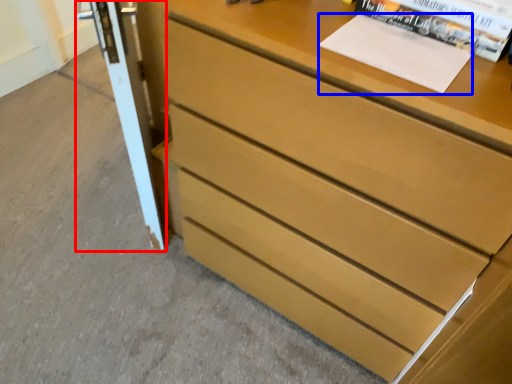
Question: Which point is closer to the camera, screen door (highlighted by a red box) or paperback book (highlighted by a blue box)?

Choices:
 (A) screen door
 (B) paperback book

Answer: (B)